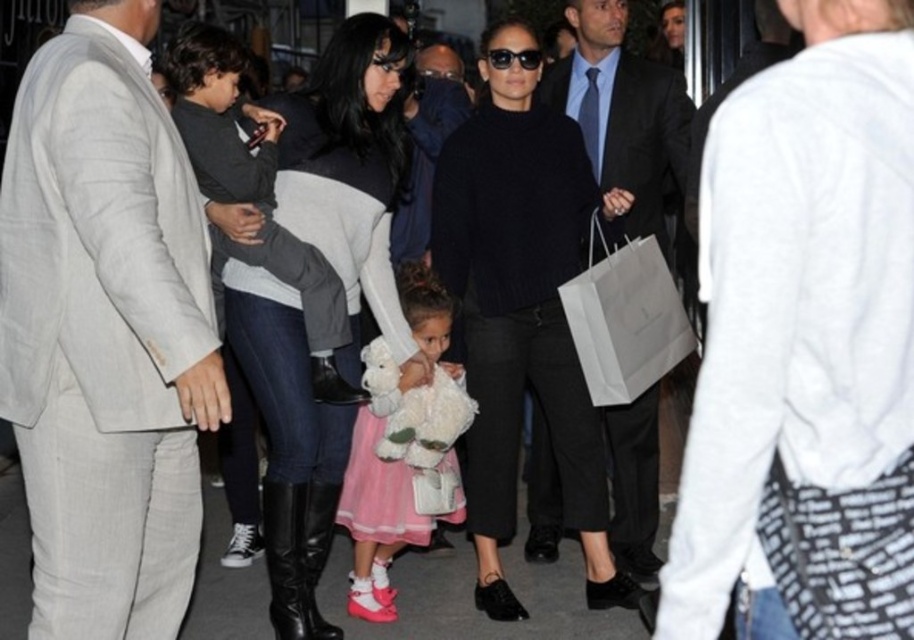
Does dark gray sweater at center have a greater width compared to black wool sweater at center?

Correct, the width of dark gray sweater at center exceeds that of black wool sweater at center.

Between dark gray sweater at center and black wool sweater at center, which one is positioned lower?

Positioned lower is dark gray sweater at center.

What do you see at coordinates (352, 173) in the screenshot? Image resolution: width=914 pixels, height=640 pixels. I see `dark gray sweater at center` at bounding box center [352, 173].

Find the location of `dark gray sweater at center`. dark gray sweater at center is located at coordinates (352, 173).

Can you confirm if white cotton shirt at upper right is positioned to the right of dark gray sweater at center?

Yes, white cotton shirt at upper right is to the right of dark gray sweater at center.

Does white cotton shirt at upper right have a greater width compared to dark gray sweater at center?

In fact, white cotton shirt at upper right might be narrower than dark gray sweater at center.

Find the location of a particular element. white cotton shirt at upper right is located at coordinates (806, 337).

Image resolution: width=914 pixels, height=640 pixels. In order to click on white cotton shirt at upper right in this screenshot , I will do `click(806, 337)`.

Is black knit sweater at center bigger than dark gray sweater at center?

Yes.

Does black knit sweater at center appear on the left side of dark gray sweater at center?

No, black knit sweater at center is not to the left of dark gray sweater at center.

Which is behind, point (440, 232) or point (251, 369)?

The point (440, 232) is behind.

At what (x,y) coordinates should I click in order to perform the action: click on black knit sweater at center. Please return your answer as a coordinate pair (x, y). This screenshot has width=914, height=640. Looking at the image, I should click on (522, 308).